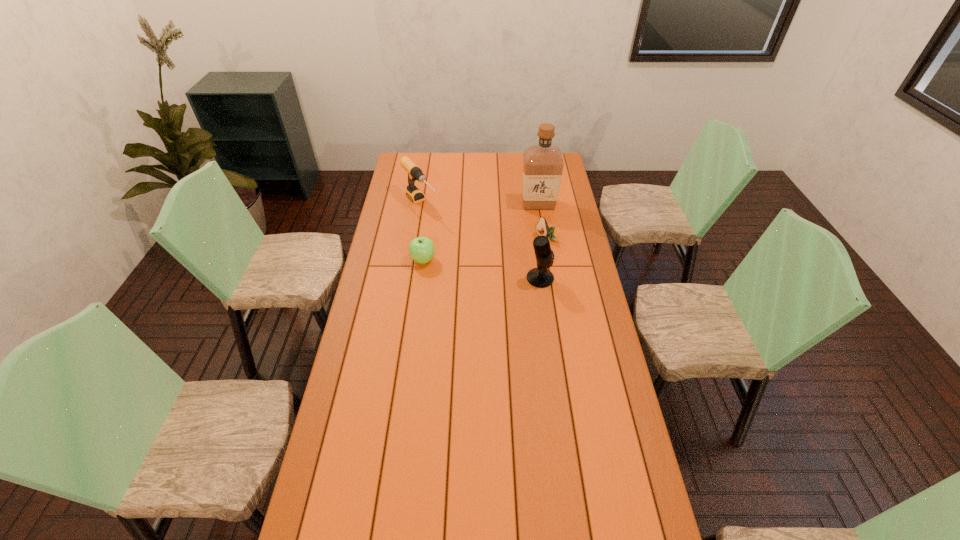
The width and height of the screenshot is (960, 540). What are the coordinates of `apple` in the screenshot? It's located at (421, 249).

I want to click on microphone, so click(x=541, y=277).

At what (x,y) coordinates should I click in order to perform the action: click on liquor. Please return your answer as a coordinate pair (x, y). The image size is (960, 540). Looking at the image, I should click on (543, 163).

Identify the location of drill. (415, 173).

Locate an element on the screen. the third farthest object is located at coordinates (542, 228).

Find the location of `vacant space situated on the front of the apple`. vacant space situated on the front of the apple is located at coordinates (420, 278).

What are the coordinates of `vacant space positioned on the stand of the microphone` in the screenshot? It's located at (590, 278).

The image size is (960, 540). In order to click on blank space located 0.400m on the front-facing side of the tallest object in this screenshot , I will do `click(486, 258)`.

I want to click on vacant point located 0.170m on the front-facing side of the tallest object, so click(513, 229).

Find the location of a particular element. free location located on the front-facing side of the tallest object is located at coordinates (495, 247).